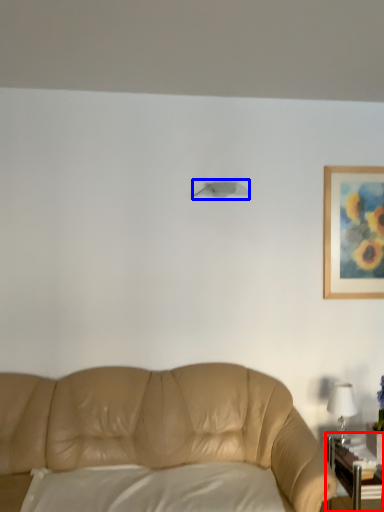
Question: Among these objects, which one is nearest to the camera, table (highlighted by a red box) or lamp (highlighted by a blue box)?

Choices:
 (A) table
 (B) lamp

Answer: (A)